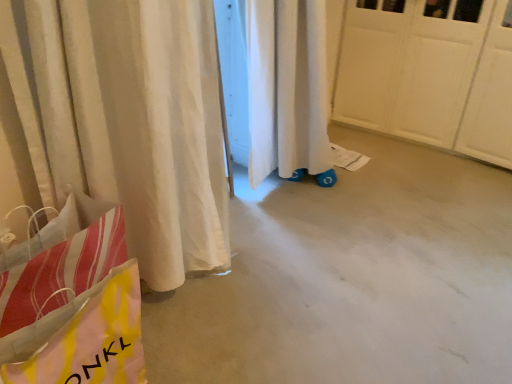
Question: Relative to yellow and pink plastic bag at lower left, is smooth concrete floor at center in front or behind?

Choices:
 (A) front
 (B) behind

Answer: (B)

Question: From their relative heights in the image, would you say smooth concrete floor at center is taller or shorter than yellow and pink plastic bag at lower left?

Choices:
 (A) short
 (B) tall

Answer: (A)

Question: From a real-world perspective, is smooth concrete floor at center above or below yellow and pink plastic bag at lower left?

Choices:
 (A) above
 (B) below

Answer: (B)

Question: Is yellow and pink plastic bag at lower left to the left or to the right of smooth concrete floor at center in the image?

Choices:
 (A) left
 (B) right

Answer: (A)

Question: Choose the correct answer: Is yellow and pink plastic bag at lower left inside smooth concrete floor at center or outside it?

Choices:
 (A) outside
 (B) inside

Answer: (A)

Question: Considering their positions, is yellow and pink plastic bag at lower left located in front of or behind smooth concrete floor at center?

Choices:
 (A) front
 (B) behind

Answer: (A)

Question: Is yellow and pink plastic bag at lower left taller or shorter than smooth concrete floor at center?

Choices:
 (A) tall
 (B) short

Answer: (A)